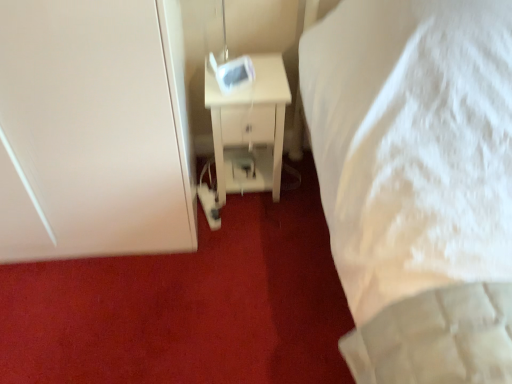
Question: From the image's perspective, is white glossy nightstand at center located above white matte door at left?

Choices:
 (A) no
 (B) yes

Answer: (A)

Question: Does white glossy nightstand at center have a smaller size compared to white matte door at left?

Choices:
 (A) yes
 (B) no

Answer: (A)

Question: Is white glossy nightstand at center not inside white matte door at left?

Choices:
 (A) yes
 (B) no

Answer: (A)

Question: Can you confirm if white glossy nightstand at center is thinner than white matte door at left?

Choices:
 (A) yes
 (B) no

Answer: (A)

Question: Is white matte door at left at the back of white glossy nightstand at center?

Choices:
 (A) yes
 (B) no

Answer: (B)

Question: Is white glossy nightstand at center oriented towards white matte door at left?

Choices:
 (A) yes
 (B) no

Answer: (B)

Question: Does white matte door at left have a smaller size compared to white glossy nightstand at center?

Choices:
 (A) yes
 (B) no

Answer: (B)

Question: Would you consider white matte door at left to be distant from white glossy nightstand at center?

Choices:
 (A) yes
 (B) no

Answer: (B)

Question: Can you confirm if white matte door at left is wider than white glossy nightstand at center?

Choices:
 (A) no
 (B) yes

Answer: (B)

Question: Are white matte door at left and white glossy nightstand at center making contact?

Choices:
 (A) no
 (B) yes

Answer: (A)

Question: Can you confirm if white matte door at left is thinner than white glossy nightstand at center?

Choices:
 (A) no
 (B) yes

Answer: (A)

Question: Is the depth of white matte door at left greater than that of white glossy nightstand at center?

Choices:
 (A) yes
 (B) no

Answer: (B)

Question: Considering the positions of point (103, 84) and point (271, 158), is point (103, 84) closer or farther from the camera than point (271, 158)?

Choices:
 (A) closer
 (B) farther

Answer: (A)